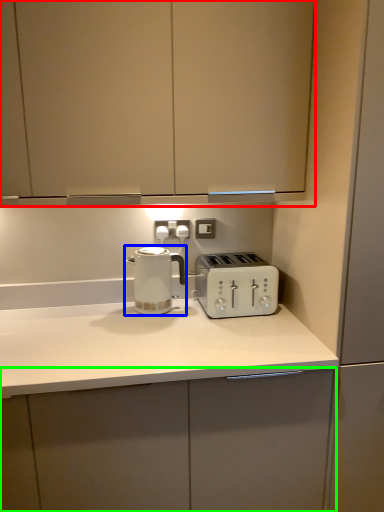
Question: Which object is positioned farthest from cabinetry (highlighted by a red box)? Select from kettle (highlighted by a blue box) and cabinetry (highlighted by a green box).

Choices:
 (A) kettle
 (B) cabinetry

Answer: (B)